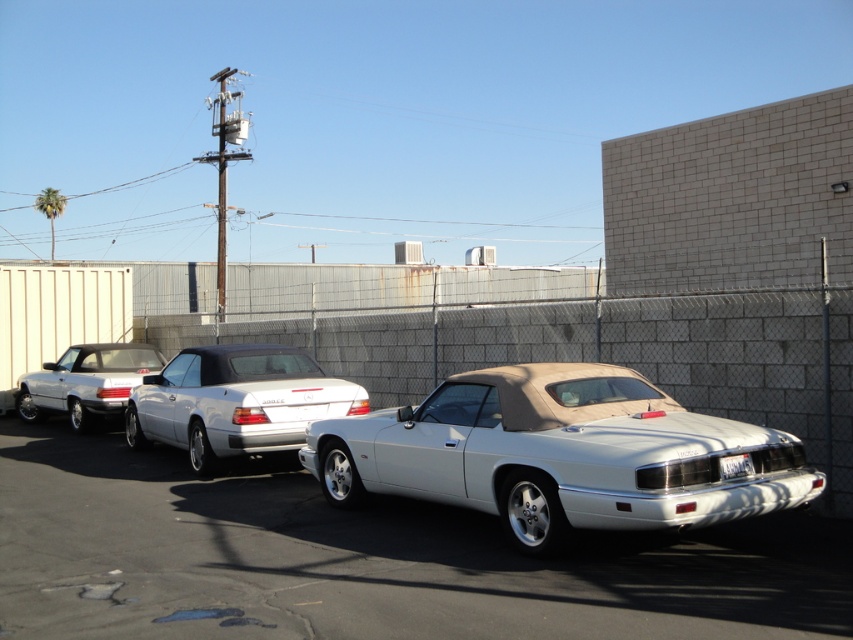
You are a parking attendant who needs to ensure that all vehicles are properly aligned. You notice the white matte sedan at left and the white plastic license plate at rear in the scene. Which vehicle is closer to the front of the parking lot?

The white matte sedan at left is positioned over the white plastic license plate at rear, meaning the white matte sedan at left is closer to the front of the parking lot since it is in front of the license plate.